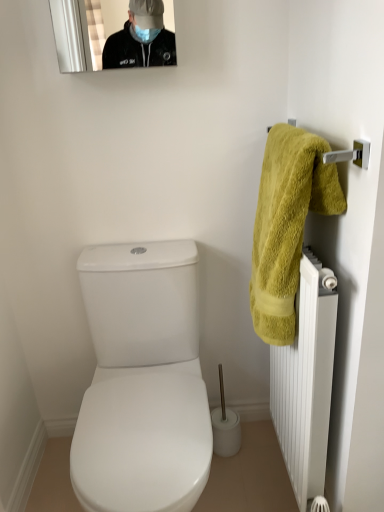
Question: From the image's perspective, is white plastic toilet brush at center below yellow fluffy towel at right?

Choices:
 (A) yes
 (B) no

Answer: (A)

Question: From a real-world perspective, does white plastic toilet brush at center sit lower than yellow fluffy towel at right?

Choices:
 (A) no
 (B) yes

Answer: (B)

Question: Is white plastic toilet brush at center positioned behind yellow fluffy towel at right?

Choices:
 (A) no
 (B) yes

Answer: (B)

Question: Is there a large distance between white plastic toilet brush at center and yellow fluffy towel at right?

Choices:
 (A) no
 (B) yes

Answer: (A)

Question: Considering the relative positions of white plastic toilet brush at center and yellow fluffy towel at right in the image provided, is white plastic toilet brush at center in front of yellow fluffy towel at right?

Choices:
 (A) yes
 (B) no

Answer: (B)

Question: Is point (299, 230) closer or farther from the camera than point (221, 408)?

Choices:
 (A) closer
 (B) farther

Answer: (A)

Question: Is yellow fluffy towel at right bigger or smaller than white plastic toilet brush at center?

Choices:
 (A) small
 (B) big

Answer: (B)

Question: Is yellow fluffy towel at right wider or thinner than white plastic toilet brush at center?

Choices:
 (A) wide
 (B) thin

Answer: (A)

Question: Is yellow fluffy towel at right inside the boundaries of white plastic toilet brush at center, or outside?

Choices:
 (A) outside
 (B) inside

Answer: (A)

Question: From the image's perspective, is white matte radiator at right positioned above or below white plastic toilet brush at center?

Choices:
 (A) below
 (B) above

Answer: (B)

Question: Visually, is white matte radiator at right positioned to the left or to the right of white plastic toilet brush at center?

Choices:
 (A) right
 (B) left

Answer: (A)

Question: From a real-world perspective, is white matte radiator at right positioned above or below white plastic toilet brush at center?

Choices:
 (A) above
 (B) below

Answer: (A)

Question: From their relative heights in the image, would you say white matte radiator at right is taller or shorter than white plastic toilet brush at center?

Choices:
 (A) tall
 (B) short

Answer: (A)

Question: From the image's perspective, relative to yellow fluffy towel at right, is white matte radiator at right above or below?

Choices:
 (A) above
 (B) below

Answer: (B)

Question: From a real-world perspective, is white matte radiator at right physically located above or below yellow fluffy towel at right?

Choices:
 (A) below
 (B) above

Answer: (A)